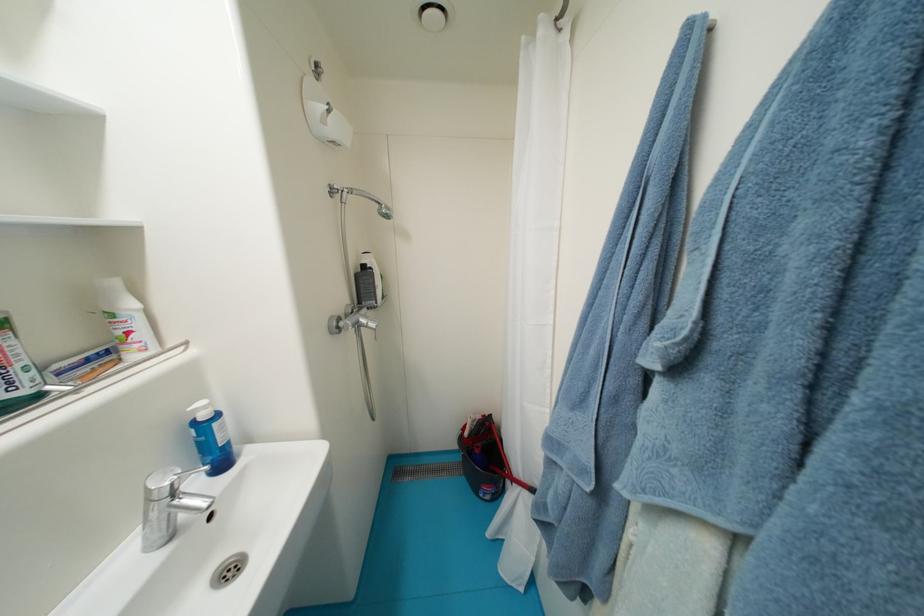
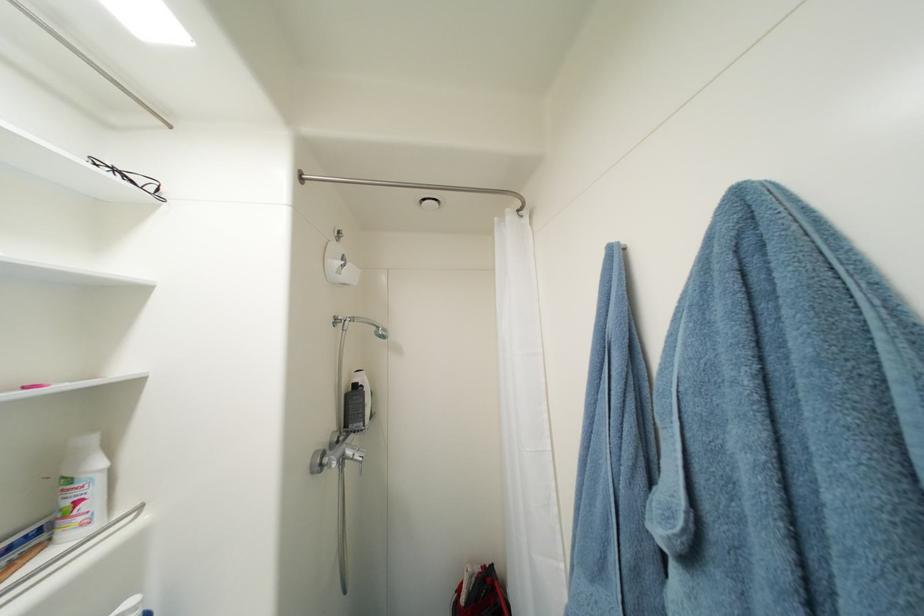
In the second image, find the point that corresponds to point 370,323 in the first image.

(356, 454)